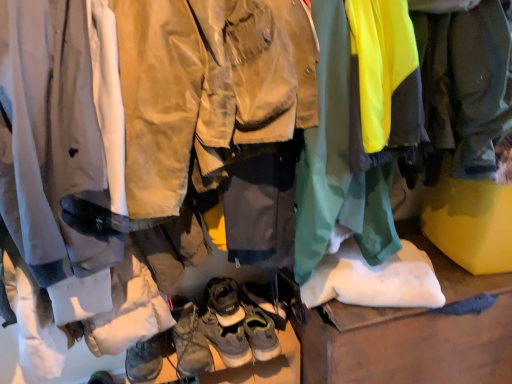
Question: Is leather brown hiking boots at center, which is the fourth footwear in top-to-bottom order, taller than leather/textured boot at center, acting as the 5th footwear starting from the bottom?

Choices:
 (A) no
 (B) yes

Answer: (B)

Question: From a real-world perspective, is leather brown hiking boots at center, which is the fourth footwear in top-to-bottom order, on leather/textured boot at center, acting as the 5th footwear starting from the bottom?

Choices:
 (A) yes
 (B) no

Answer: (B)

Question: Is leather brown hiking boots at center, the 2th footwear from the bottom, positioned in front of leather/textured boot at center, acting as the 5th footwear starting from the bottom?

Choices:
 (A) no
 (B) yes

Answer: (B)

Question: Considering the relative sizes of leather brown hiking boots at center, the 2th footwear from the bottom, and leather/textured boot at center, which appears as the first footwear when viewed from the top, in the image provided, is leather brown hiking boots at center, the 2th footwear from the bottom, thinner than leather/textured boot at center, which appears as the first footwear when viewed from the top,?

Choices:
 (A) yes
 (B) no

Answer: (B)

Question: Can you confirm if leather brown hiking boots at center, the 2th footwear from the bottom, is bigger than leather/textured boot at center, which appears as the first footwear when viewed from the top?

Choices:
 (A) no
 (B) yes

Answer: (B)

Question: Is leather/textured boot at center, which appears as the first footwear when viewed from the top, wider or thinner than brown leather boots at center, marked as the 1th footwear in a bottom-to-top arrangement?

Choices:
 (A) wide
 (B) thin

Answer: (A)

Question: Based on their positions, is leather/textured boot at center, which appears as the first footwear when viewed from the top, located to the left or right of brown leather boots at center, marked as the 1th footwear in a bottom-to-top arrangement?

Choices:
 (A) right
 (B) left

Answer: (A)

Question: From the image's perspective, is leather/textured boot at center, acting as the 5th footwear starting from the bottom, above or below brown leather boots at center, marked as the 1th footwear in a bottom-to-top arrangement?

Choices:
 (A) below
 (B) above

Answer: (B)

Question: From a real-world perspective, is leather/textured boot at center, acting as the 5th footwear starting from the bottom, above or below brown leather boots at center, which ranks as the fifth footwear in top-to-bottom order?

Choices:
 (A) below
 (B) above

Answer: (B)

Question: From the image's perspective, relative to brown leather boots at center, marked as the 1th footwear in a bottom-to-top arrangement, is leather/textured boots at center, acting as the 3th footwear starting from the top, above or below?

Choices:
 (A) above
 (B) below

Answer: (A)

Question: Do you think leather/textured boots at center, acting as the 3th footwear starting from the top, is within brown leather boots at center, marked as the 1th footwear in a bottom-to-top arrangement, or outside of it?

Choices:
 (A) outside
 (B) inside

Answer: (A)

Question: Looking at the image, does leather/textured boots at center, which appears as the third footwear when ordered from the bottom, seem bigger or smaller compared to brown leather boots at center, which ranks as the fifth footwear in top-to-bottom order?

Choices:
 (A) big
 (B) small

Answer: (B)

Question: Relative to brown leather boots at center, marked as the 1th footwear in a bottom-to-top arrangement, is leather/textured boots at center, which appears as the third footwear when ordered from the bottom, in front or behind?

Choices:
 (A) front
 (B) behind

Answer: (A)

Question: Choose the correct answer: Is leather/textured boot at center, which appears as the first footwear when viewed from the top, inside leather/textured boots at center, which appears as the third footwear when ordered from the bottom, or outside it?

Choices:
 (A) inside
 (B) outside

Answer: (B)

Question: Relative to leather/textured boots at center, acting as the 3th footwear starting from the top, is leather/textured boot at center, which appears as the first footwear when viewed from the top, in front or behind?

Choices:
 (A) behind
 (B) front

Answer: (A)